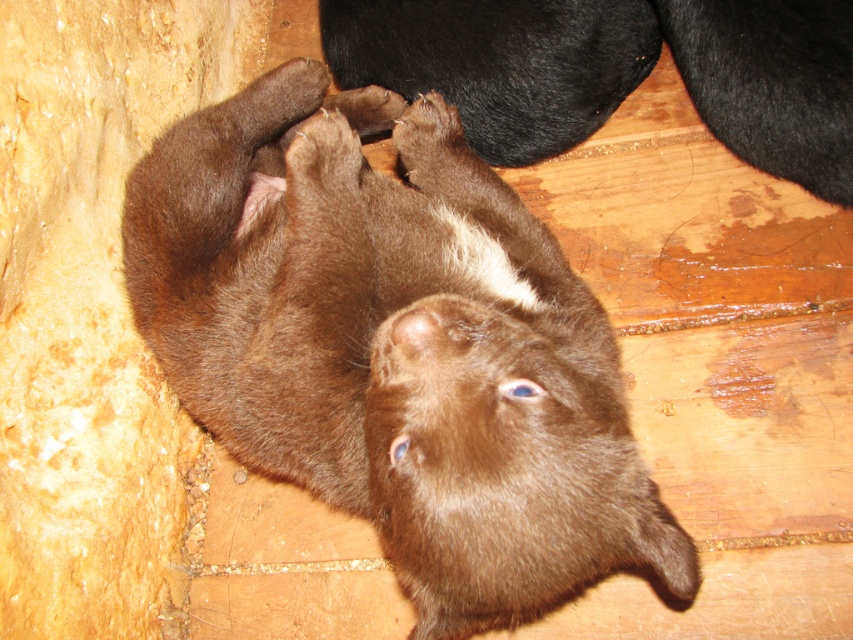
Question: Is brown furry bear cub at center above brown fur at upper center?

Choices:
 (A) yes
 (B) no

Answer: (B)

Question: Does brown furry bear cub at center have a larger size compared to brown fur at upper center?

Choices:
 (A) no
 (B) yes

Answer: (B)

Question: Which of the following is the farthest from the observer?

Choices:
 (A) brown furry bear cub at center
 (B) brown fur at upper center

Answer: (B)

Question: Which point appears closest to the camera in this image?

Choices:
 (A) (242, 131)
 (B) (387, 60)

Answer: (A)

Question: Where is brown furry bear cub at center located in relation to brown fur at upper center in the image?

Choices:
 (A) left
 (B) right

Answer: (A)

Question: Which point is farther to the camera?

Choices:
 (A) brown furry bear cub at center
 (B) brown fur at upper center

Answer: (B)